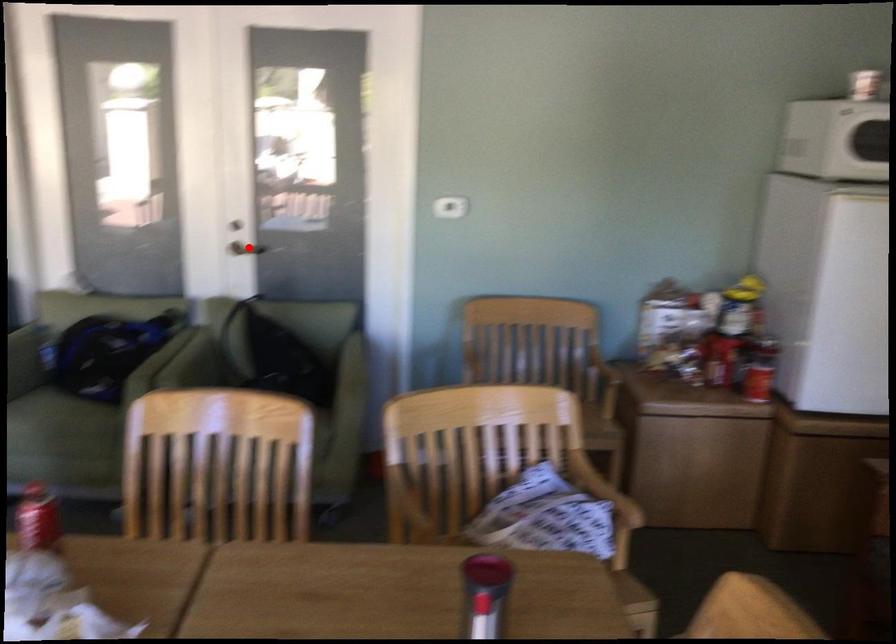
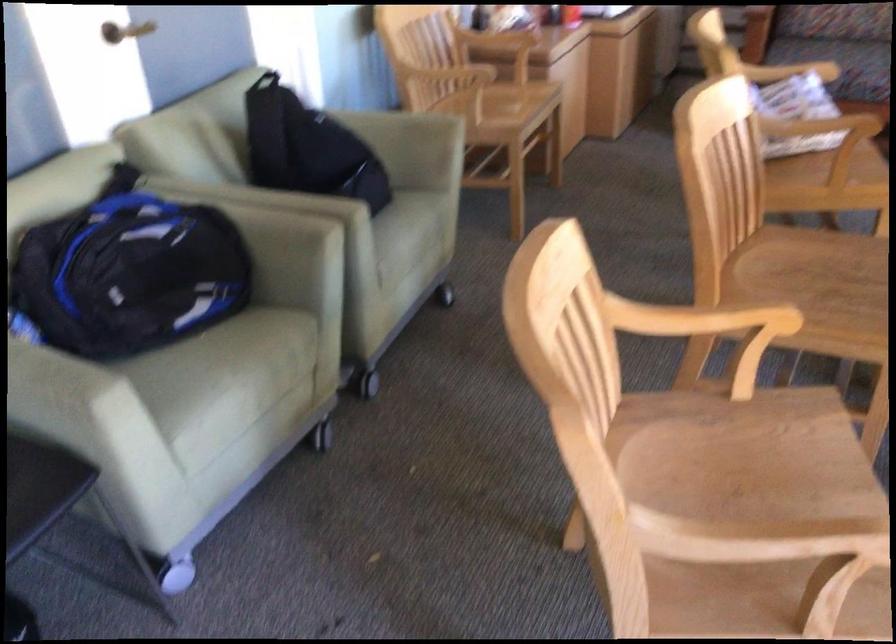
Question: A red point is marked in image1. In image2, is the corresponding 3D point closer to the camera or farther? Reply with the corresponding letter.

Choices:
 (A) The corresponding 3D point is closer.
 (B) The corresponding 3D point is farther.

Answer: (A)